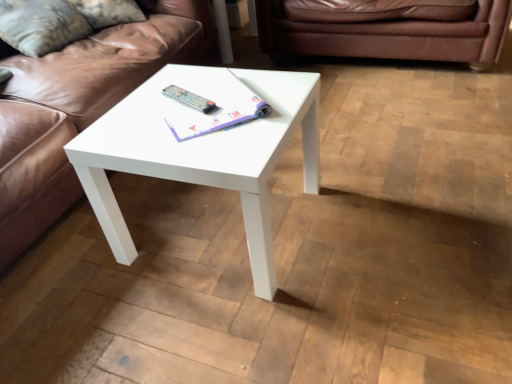
Identify the location of unoccupied region to the right of white paper book at center. The image size is (512, 384). (276, 93).